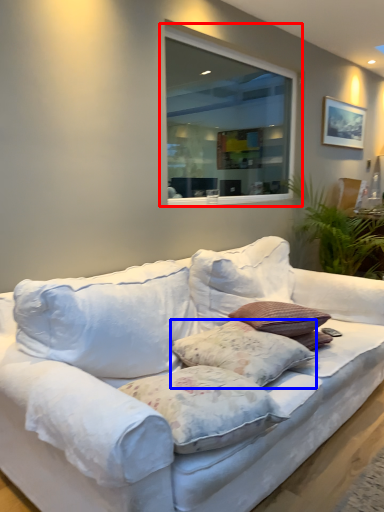
Question: Which object is further to the camera taking this photo, window (highlighted by a red box) or pillow (highlighted by a blue box)?

Choices:
 (A) window
 (B) pillow

Answer: (A)